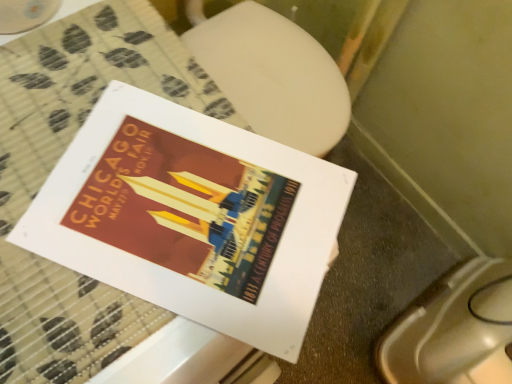
Question: Does point (222, 329) appear closer or farther from the camera than point (467, 375)?

Choices:
 (A) closer
 (B) farther

Answer: (A)

Question: From the image's perspective, is matte paper poster at center above or below white glossy toilet bowl at lower right?

Choices:
 (A) below
 (B) above

Answer: (B)

Question: Is matte paper poster at center inside the boundaries of white glossy toilet bowl at lower right, or outside?

Choices:
 (A) outside
 (B) inside

Answer: (A)

Question: From a real-world perspective, is white glossy toilet bowl at lower right positioned above or below matte paper poster at center?

Choices:
 (A) above
 (B) below

Answer: (B)

Question: Is white glossy toilet bowl at lower right to the left or to the right of matte paper poster at center in the image?

Choices:
 (A) right
 (B) left

Answer: (A)

Question: Considering the positions of white glossy toilet bowl at lower right and matte paper poster at center in the image, is white glossy toilet bowl at lower right bigger or smaller than matte paper poster at center?

Choices:
 (A) big
 (B) small

Answer: (A)

Question: Is white glossy toilet bowl at lower right taller or shorter than matte paper poster at center?

Choices:
 (A) tall
 (B) short

Answer: (A)